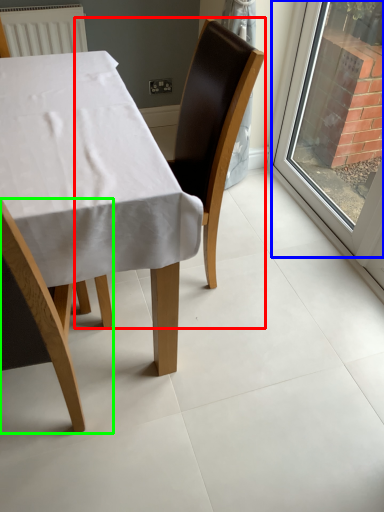
Question: Based on their relative distances, which object is nearer to chair (highlighted by a red box)? Choose from window (highlighted by a blue box) and chair (highlighted by a green box).

Choices:
 (A) window
 (B) chair

Answer: (B)